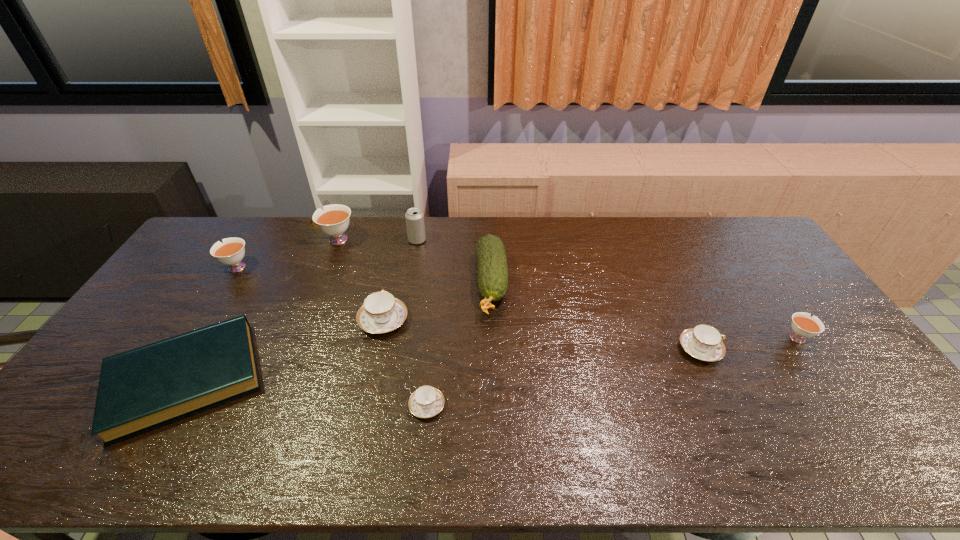
Identify the location of free space located 0.320m at the blossom end of the third object from right to left. This screenshot has height=540, width=960. (495, 420).

Where is `free space located on the side of the leftmost teacup with the handle`? The height and width of the screenshot is (540, 960). free space located on the side of the leftmost teacup with the handle is located at coordinates (203, 268).

The image size is (960, 540). I want to click on free location located 0.330m on the side with the handle of the leftmost blue teacup, so click(x=401, y=239).

Where is `vacant space located 0.270m on the side with the handle of the leftmost blue teacup`? The width and height of the screenshot is (960, 540). vacant space located 0.270m on the side with the handle of the leftmost blue teacup is located at coordinates (398, 249).

Identify the location of vacant position located 0.130m on the side with the handle of the leftmost blue teacup. The image size is (960, 540). (394, 275).

I want to click on free location located 0.330m on the side of the nearest white teacup with the handle, so click(x=739, y=255).

Where is `blank space located on the side of the nearest white teacup with the handle`? This screenshot has width=960, height=540. blank space located on the side of the nearest white teacup with the handle is located at coordinates 772,301.

The image size is (960, 540). I want to click on blank space located on the side of the nearest white teacup with the handle, so click(x=768, y=296).

The image size is (960, 540). In order to click on vacant position located 0.160m on the side with the handle of the rightmost blue teacup in this screenshot , I will do click(x=779, y=349).

Locate an element on the screen. The image size is (960, 540). free space located 0.090m on the back of the book is located at coordinates (230, 305).